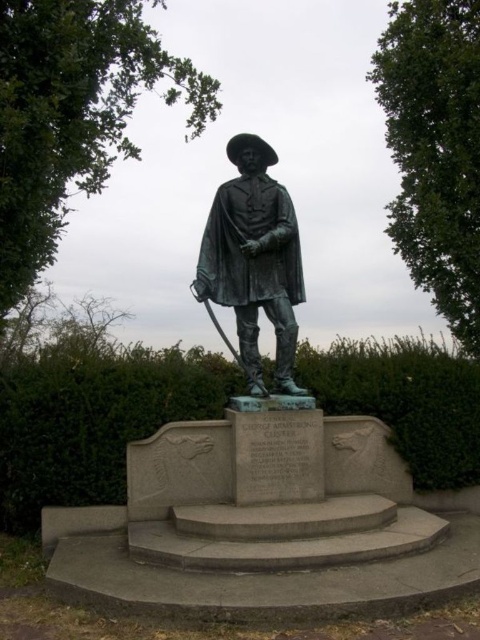
Is green hedge at center further to the viewer compared to bronze statue at center?

No, green hedge at center is in front of bronze statue at center.

Is green hedge at center taller than bronze statue at center?

In fact, green hedge at center may be shorter than bronze statue at center.

Locate an element on the screen. The width and height of the screenshot is (480, 640). green hedge at center is located at coordinates tap(93, 417).